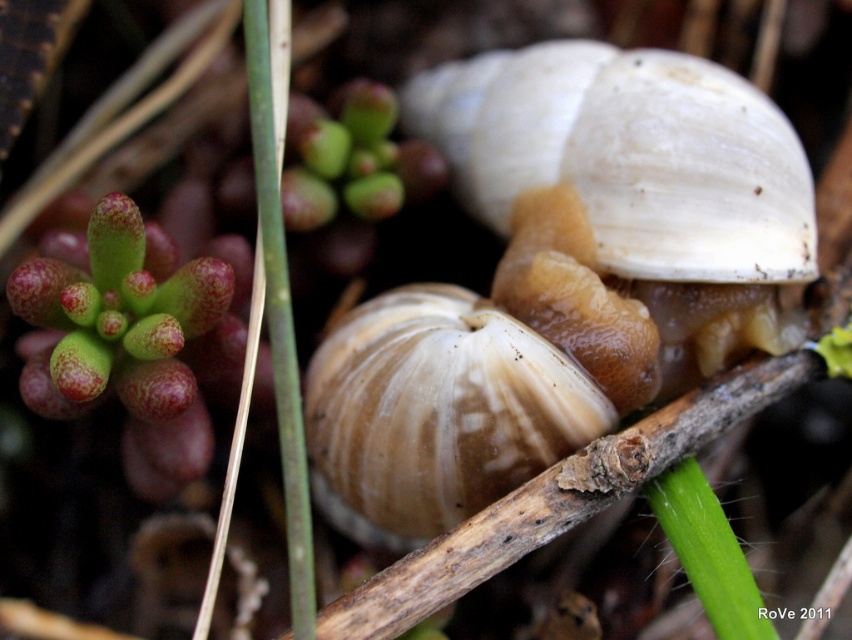
Is white matte snail at center above matte brown shell at center?

Yes.

What do you see at coordinates (630, 156) in the screenshot? I see `white matte snail at center` at bounding box center [630, 156].

Image resolution: width=852 pixels, height=640 pixels. I want to click on white matte snail at center, so tap(630, 156).